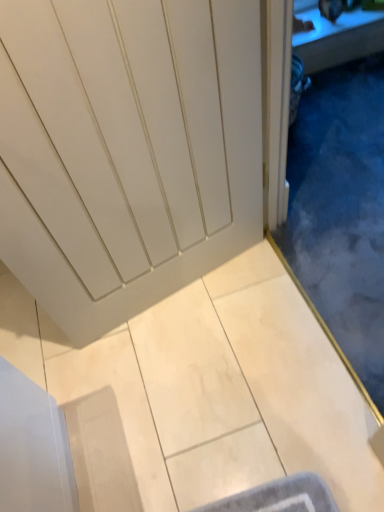
Image resolution: width=384 pixels, height=512 pixels. What do you see at coordinates (202, 394) in the screenshot?
I see `white matte door at center` at bounding box center [202, 394].

Locate an element on the screen. white matte door at center is located at coordinates (202, 394).

Image resolution: width=384 pixels, height=512 pixels. Find the location of `white matte door at center`. white matte door at center is located at coordinates (202, 394).